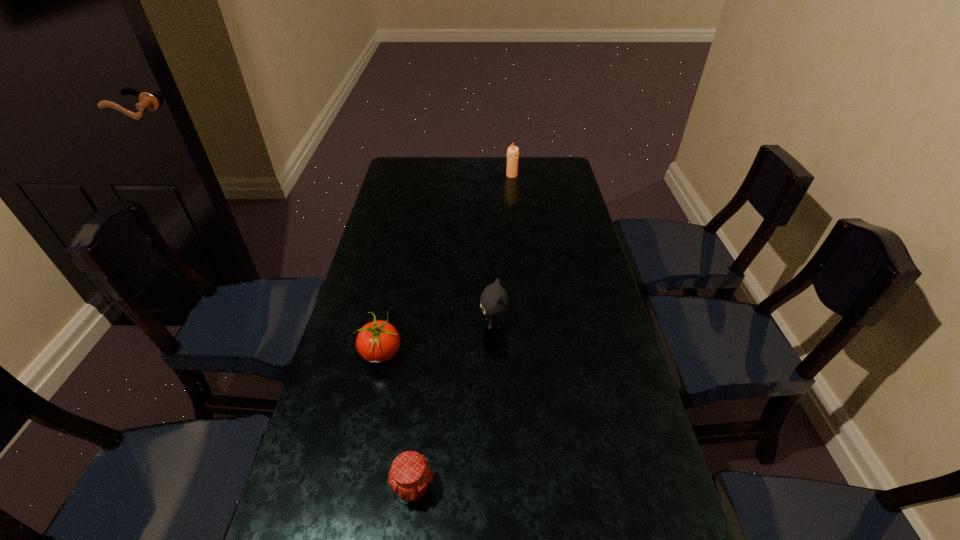
Identify the location of vacant point located between the kitten and the farthest object. (503, 250).

The image size is (960, 540). Identify the location of free space between the tomato and the shortest object. (396, 421).

Find the location of a particular element. The image size is (960, 540). unoccupied position between the rightmost object and the shortest object is located at coordinates (463, 332).

At what (x,y) coordinates should I click in order to perform the action: click on free spot between the leftmost object and the farthest object. Please return your answer as a coordinate pair (x, y). The width and height of the screenshot is (960, 540). Looking at the image, I should click on (446, 265).

This screenshot has width=960, height=540. I want to click on free space between the leftmost object and the farthest object, so click(446, 265).

Where is `free space between the nearest object and the second object from right to left`? Image resolution: width=960 pixels, height=540 pixels. free space between the nearest object and the second object from right to left is located at coordinates (453, 406).

You are a GUI agent. You are given a task and a screenshot of the screen. Output one action in this format:
    pyautogui.click(x=<x>, y=<y>)
    Task: Click on the free area in between the third object from right to left and the second object from right to left
    
    Given the screenshot: What is the action you would take?
    pyautogui.click(x=453, y=406)

The image size is (960, 540). Find the location of `free space between the candle and the leftmost object`. free space between the candle and the leftmost object is located at coordinates (446, 265).

This screenshot has width=960, height=540. In order to click on empty space between the kitten and the jam in this screenshot , I will do `click(453, 406)`.

Identify the location of the third closest object to the third object from left to right. Image resolution: width=960 pixels, height=540 pixels. (513, 151).